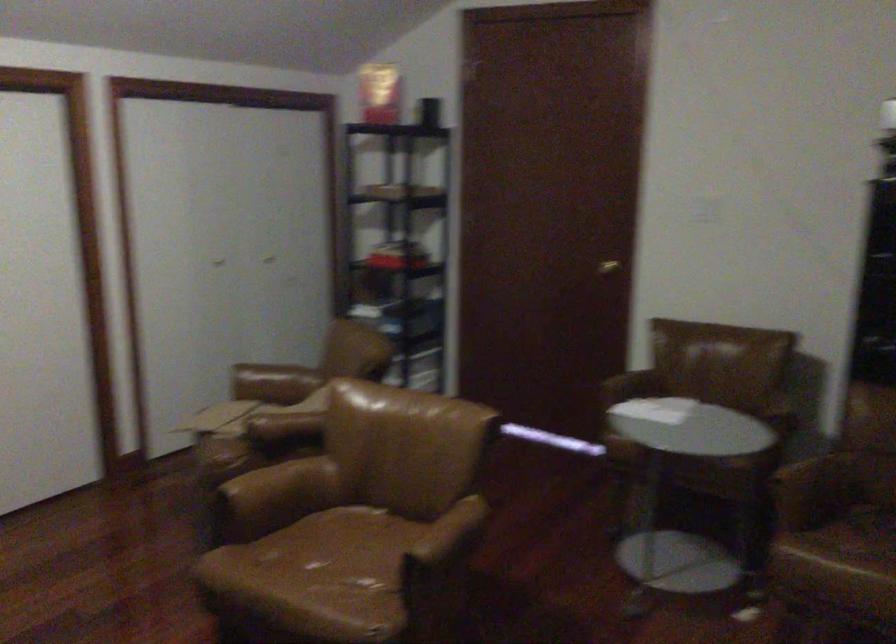
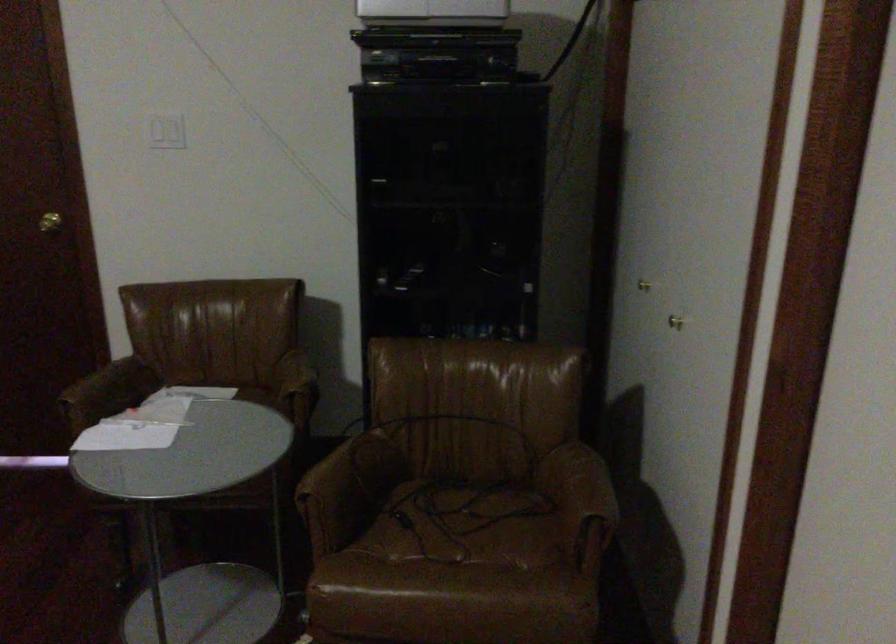
The point at (x=617, y=263) is marked in the first image. Where is the corresponding point in the second image?

(49, 222)